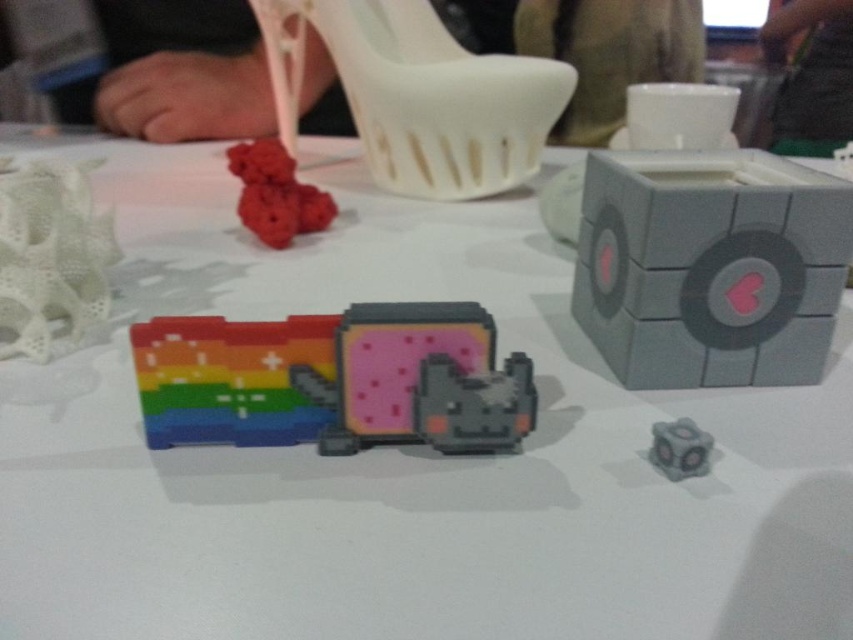
You are an artist trying to arrange these objects for a photo shoot. You want to place a new, smaller cube between the gray matte cube at center right and the white matte sculpture at left. Based on their heights, which object should the new cube be closer to?

The new cube should be closer to the white matte sculpture at left because the gray matte cube at center right is taller than the white matte sculpture at left, so the smaller cube would need to be placed closer to the shorter object to maintain visual balance.

You are organizing a display and need to stack items vertically. You have a white matte shoe at upper center and a white matte sculpture at left. Which item should you place at the bottom to ensure stability?

You should place the white matte shoe at upper center at the bottom because it has a greater height than the white matte sculpture at left, providing a more stable base.